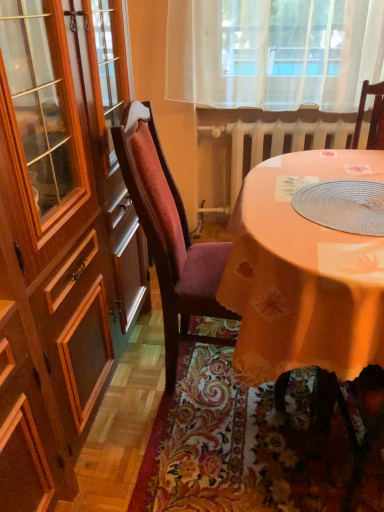
Question: Is orange fabric table at center looking in the opposite direction of white painted metal radiator at center?

Choices:
 (A) yes
 (B) no

Answer: (A)

Question: Is orange fabric table at center not near white painted metal radiator at center?

Choices:
 (A) no
 (B) yes

Answer: (A)

Question: From the image's perspective, would you say orange fabric table at center is shown under white painted metal radiator at center?

Choices:
 (A) yes
 (B) no

Answer: (A)

Question: Can you confirm if orange fabric table at center is thinner than white painted metal radiator at center?

Choices:
 (A) no
 (B) yes

Answer: (A)

Question: From the image's perspective, is orange fabric table at center on white painted metal radiator at center?

Choices:
 (A) no
 (B) yes

Answer: (A)

Question: Is clear plastic placemat at center bigger or smaller than white painted metal radiator at center?

Choices:
 (A) big
 (B) small

Answer: (B)

Question: From their relative heights in the image, would you say clear plastic placemat at center is taller or shorter than white painted metal radiator at center?

Choices:
 (A) short
 (B) tall

Answer: (A)

Question: Considering their positions, is clear plastic placemat at center located in front of or behind white painted metal radiator at center?

Choices:
 (A) front
 (B) behind

Answer: (A)

Question: Is point (311, 196) closer or farther from the camera than point (336, 137)?

Choices:
 (A) closer
 (B) farther

Answer: (A)

Question: From the image's perspective, relative to orange fabric table at center, is white painted metal radiator at center above or below?

Choices:
 (A) above
 (B) below

Answer: (A)

Question: In terms of height, does white painted metal radiator at center look taller or shorter compared to orange fabric table at center?

Choices:
 (A) tall
 (B) short

Answer: (B)

Question: Is white painted metal radiator at center inside the boundaries of orange fabric table at center, or outside?

Choices:
 (A) outside
 (B) inside

Answer: (A)

Question: Considering the positions of white painted metal radiator at center and orange fabric table at center in the image, is white painted metal radiator at center wider or thinner than orange fabric table at center?

Choices:
 (A) wide
 (B) thin

Answer: (B)

Question: Is clear plastic placemat at center wider or thinner than silky orange tablecloth at lower center?

Choices:
 (A) thin
 (B) wide

Answer: (A)

Question: From the image's perspective, is clear plastic placemat at center above or below silky orange tablecloth at lower center?

Choices:
 (A) below
 (B) above

Answer: (B)